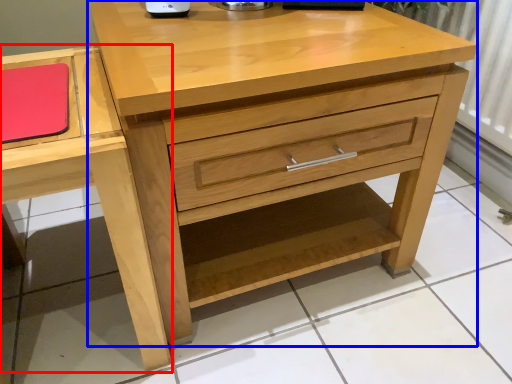
Question: Which object is further to the camera taking this photo, vanity (highlighted by a red box) or chest of drawers (highlighted by a blue box)?

Choices:
 (A) vanity
 (B) chest of drawers

Answer: (B)